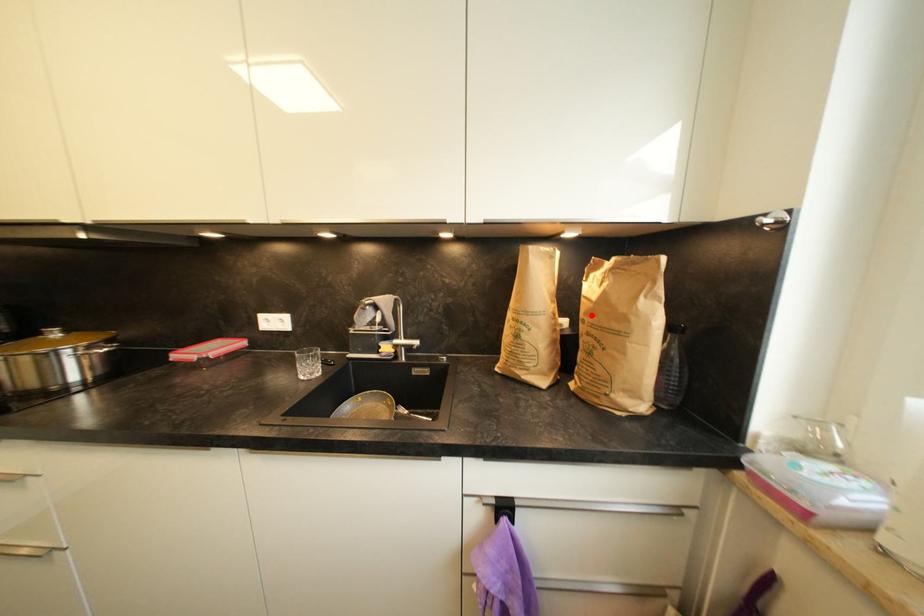
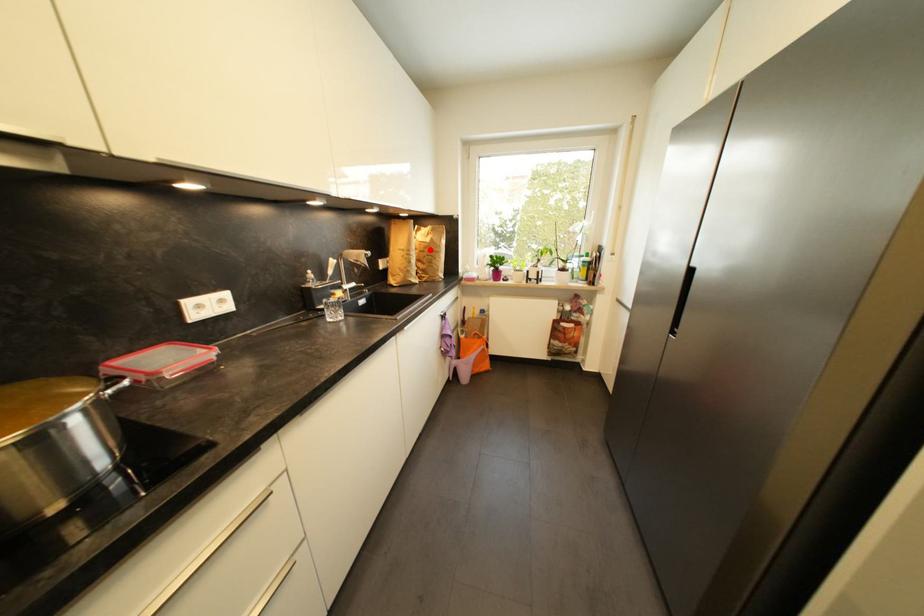
I am providing you with two images of the same scene from different viewpoints. A red point is marked on the first image and another point is marked on the second image. Do the highlighted points in image1 and image2 indicate the same real-world spot?

Yes